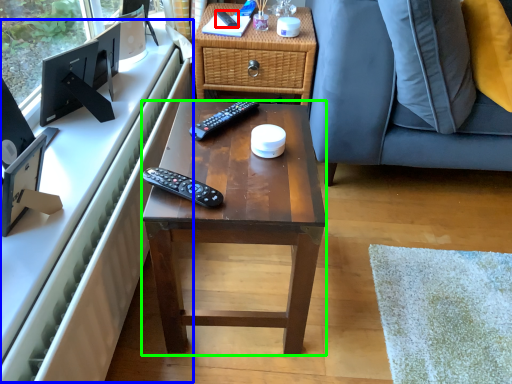
Question: Based on their relative distances, which object is farther from remote control (highlighted by a red box)? Choose from computer desk (highlighted by a blue box) and desk (highlighted by a green box).

Choices:
 (A) computer desk
 (B) desk

Answer: (B)